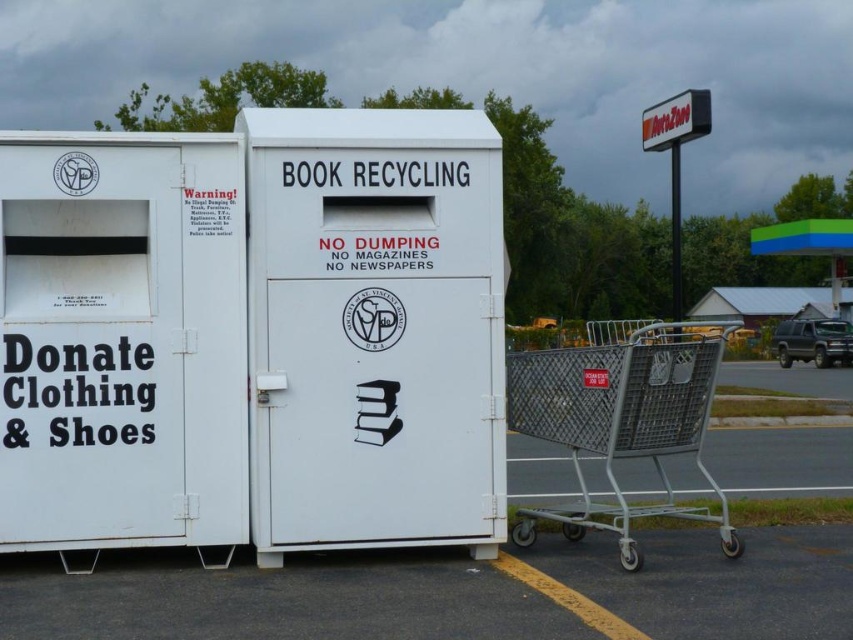
Question: Can you confirm if white metal shopping cart at lower right is wider than white plastic sign at upper center?

Choices:
 (A) yes
 (B) no

Answer: (B)

Question: Which of the following is the closest to the observer?

Choices:
 (A) (549, 548)
 (B) (676, 410)

Answer: (B)

Question: Does white metal shopping cart at lower right appear on the left side of white plastic sign at upper center?

Choices:
 (A) yes
 (B) no

Answer: (A)

Question: Which object appears farthest from the camera in this image?

Choices:
 (A) white plastic sign at upper center
 (B) metallic gray shopping cart at lower right
 (C) white metal shopping cart at lower right

Answer: (A)

Question: Which object is farther from the camera taking this photo?

Choices:
 (A) white metal shopping cart at lower right
 (B) metallic gray shopping cart at lower right

Answer: (B)

Question: Does metallic gray shopping cart at lower right have a lesser width compared to white plastic sign at upper center?

Choices:
 (A) yes
 (B) no

Answer: (B)